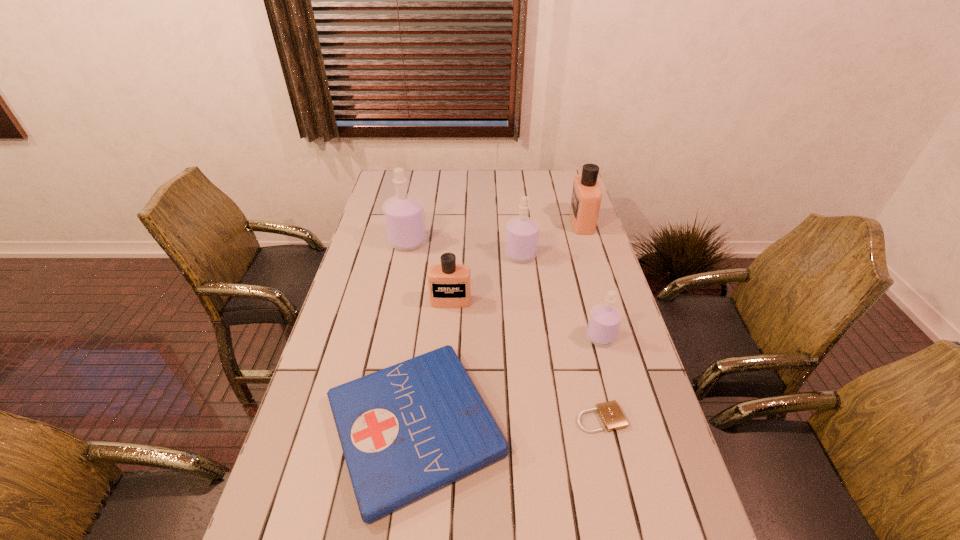
Where is `the leftmost purple perfume`? the leftmost purple perfume is located at coordinates (404, 216).

This screenshot has height=540, width=960. What are the coordinates of `the tallest object` in the screenshot? It's located at [404, 216].

At what (x,y) coordinates should I click in order to perform the action: click on the third perfume from right to left. Please return your answer as a coordinate pair (x, y). Looking at the image, I should click on (522, 233).

Identify the location of the fourth object from right to left. The height and width of the screenshot is (540, 960). (522, 233).

This screenshot has height=540, width=960. Identify the location of the bigger beige perfume. (586, 197).

Locate an element on the screen. The image size is (960, 540). the right beige perfume is located at coordinates (586, 197).

What are the coordinates of `the fifth farthest object` in the screenshot? It's located at (604, 322).

Locate an element on the screen. This screenshot has width=960, height=540. the smallest purple perfume is located at coordinates (604, 322).

Identify the location of the fourth farthest perfume. (449, 284).

This screenshot has height=540, width=960. I want to click on the nearer beige perfume, so click(449, 284).